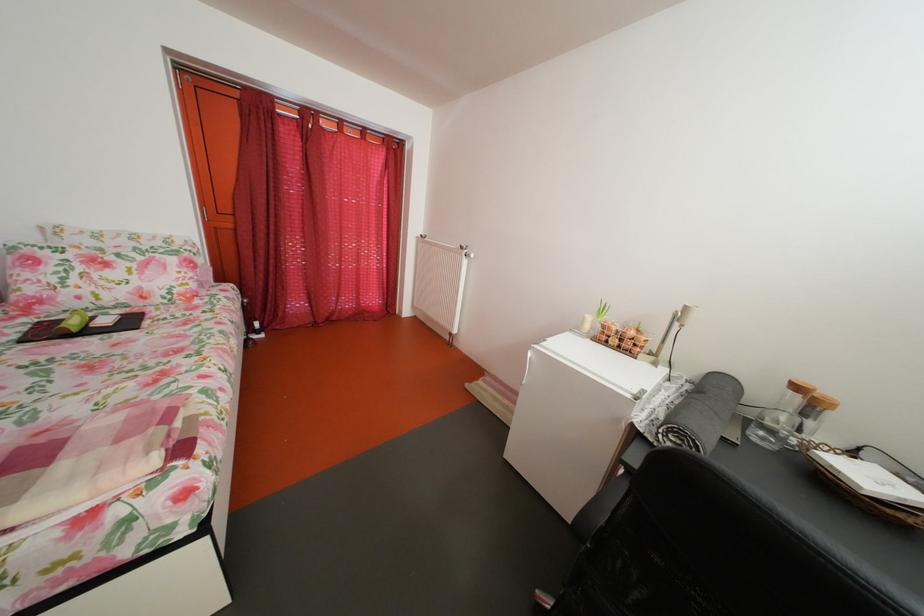
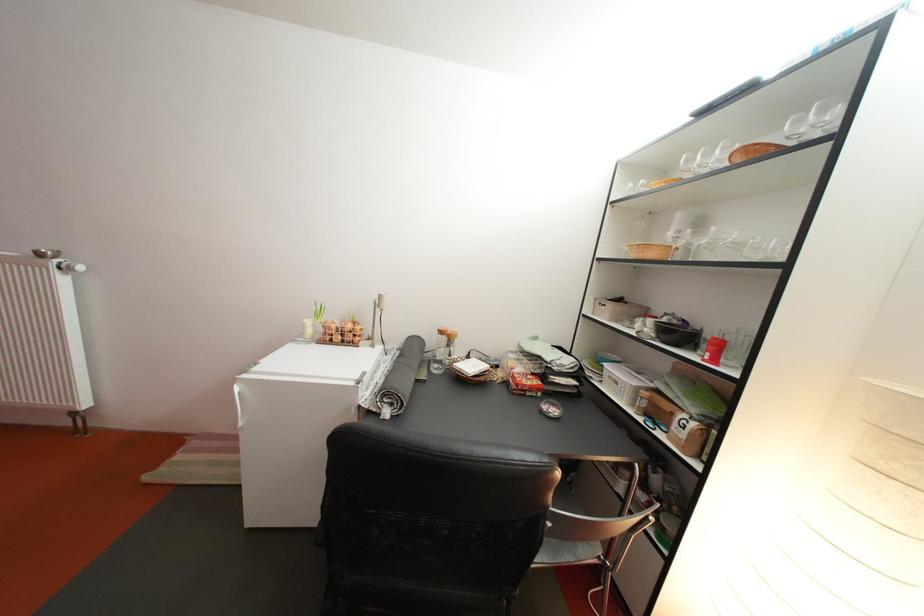
Question: The first image is from the beginning of the video and the second image is from the end. How did the camera likely rotate when shooting the video?

Choices:
 (A) Left
 (B) Right
 (C) Up
 (D) Down

Answer: (B)